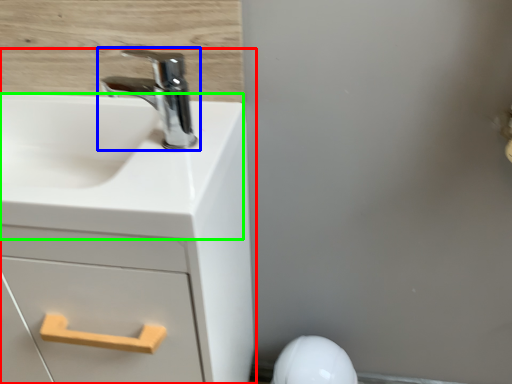
Question: Considering the real-world distances, which object is closest to bathroom cabinet (highlighted by a red box)? tap (highlighted by a blue box) or counter top (highlighted by a green box).

Choices:
 (A) tap
 (B) counter top

Answer: (B)